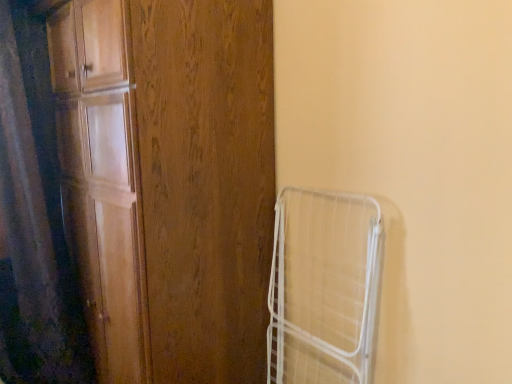
Question: Is black matte shower curtain at left further to the viewer compared to white wire cage at right?

Choices:
 (A) yes
 (B) no

Answer: (A)

Question: Is black matte shower curtain at left shorter than white wire cage at right?

Choices:
 (A) no
 (B) yes

Answer: (A)

Question: Is black matte shower curtain at left in contact with white wire cage at right?

Choices:
 (A) yes
 (B) no

Answer: (B)

Question: Can you confirm if black matte shower curtain at left is taller than white wire cage at right?

Choices:
 (A) no
 (B) yes

Answer: (B)

Question: Is black matte shower curtain at left smaller than white wire cage at right?

Choices:
 (A) yes
 (B) no

Answer: (B)

Question: Is white wire cage at right situated inside black matte shower curtain at left or outside?

Choices:
 (A) inside
 (B) outside

Answer: (B)

Question: Looking at their shapes, would you say white wire cage at right is wider or thinner than black matte shower curtain at left?

Choices:
 (A) wide
 (B) thin

Answer: (B)

Question: From the image's perspective, is white wire cage at right located above or below black matte shower curtain at left?

Choices:
 (A) above
 (B) below

Answer: (B)

Question: In terms of height, does white wire cage at right look taller or shorter compared to black matte shower curtain at left?

Choices:
 (A) short
 (B) tall

Answer: (A)

Question: Considering their positions, is wooden door at left located in front of or behind white wire cage at right?

Choices:
 (A) behind
 (B) front

Answer: (B)

Question: Considering the positions of wooden door at left and white wire cage at right in the image, is wooden door at left bigger or smaller than white wire cage at right?

Choices:
 (A) big
 (B) small

Answer: (A)

Question: Considering the positions of point (102, 29) and point (295, 213), is point (102, 29) closer or farther from the camera than point (295, 213)?

Choices:
 (A) closer
 (B) farther

Answer: (A)

Question: From a real-world perspective, is wooden door at left above or below white wire cage at right?

Choices:
 (A) above
 (B) below

Answer: (A)

Question: From a real-world perspective, is white wire cage at right physically located above or below wooden door at left?

Choices:
 (A) below
 (B) above

Answer: (A)

Question: From the image's perspective, is white wire cage at right positioned above or below wooden door at left?

Choices:
 (A) above
 (B) below

Answer: (B)